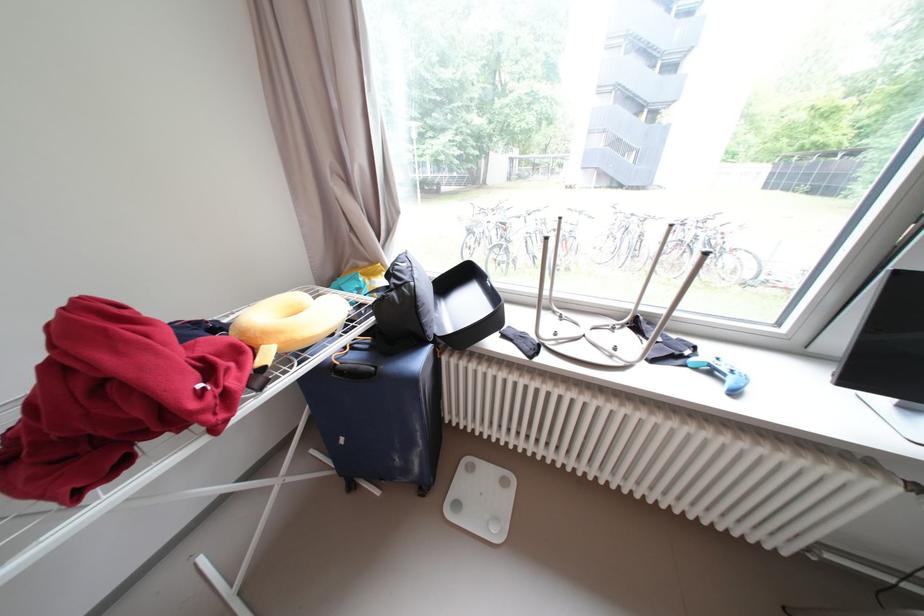
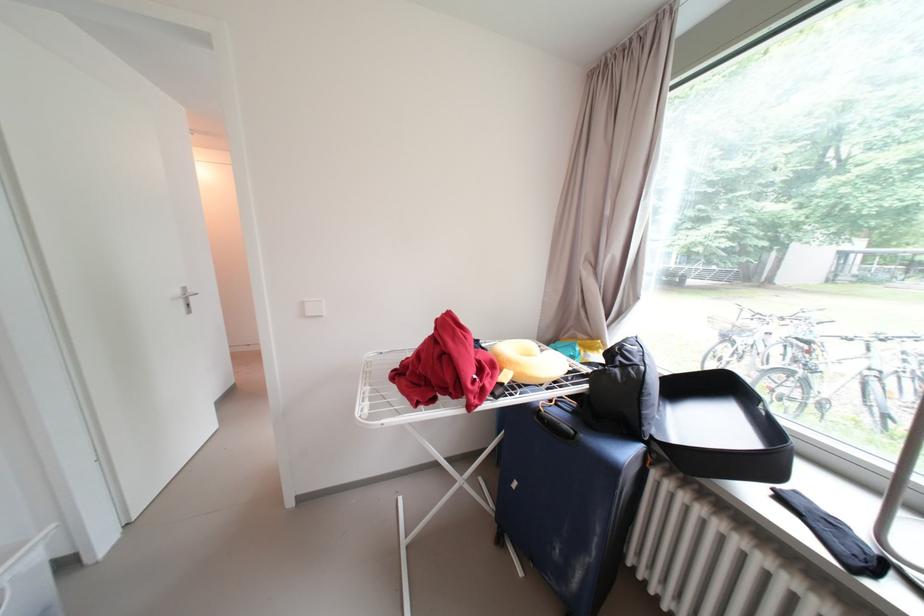
The point at (290, 339) is marked in the first image. Where is the corresponding point in the second image?

(527, 371)